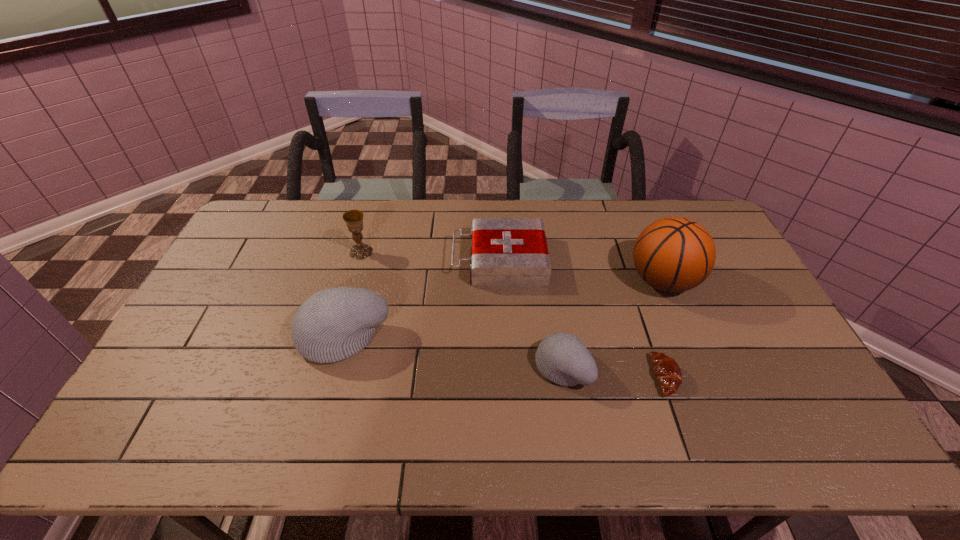
The height and width of the screenshot is (540, 960). I want to click on the left beanie, so click(x=333, y=324).

Identify the location of the fourth tallest object. This screenshot has height=540, width=960. (562, 358).

Locate an element on the screen. the shorter beanie is located at coordinates (562, 358).

This screenshot has height=540, width=960. I want to click on the second shortest object, so click(x=506, y=252).

Locate an element on the screen. basketball is located at coordinates point(673,254).

Where is `chalice`? chalice is located at coordinates (353, 218).

This screenshot has height=540, width=960. I want to click on crescent roll, so click(666, 370).

The width and height of the screenshot is (960, 540). I want to click on free space located on the right of the left beanie, so click(461, 335).

At what (x,y) coordinates should I click in order to perform the action: click on free space located on the right of the third shortest object. Please return your answer as a coordinate pair (x, y). This screenshot has height=540, width=960. Looking at the image, I should click on (709, 367).

Locate an element on the screen. Image resolution: width=960 pixels, height=540 pixels. vacant space located on the front side of the first-aid kit is located at coordinates pyautogui.click(x=429, y=260).